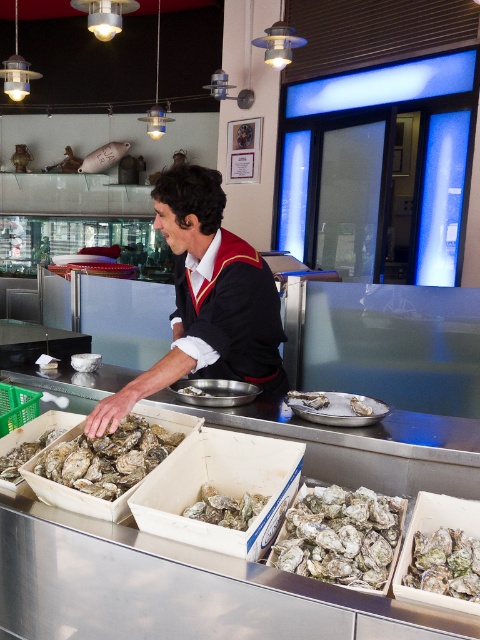
Question: Is shiny gray oyster at center further to camera compared to shiny silver oyster at lower left?

Choices:
 (A) no
 (B) yes

Answer: (A)

Question: Does white matte oyster at center appear under shiny silver oyster at lower left?

Choices:
 (A) yes
 (B) no

Answer: (A)

Question: Which point is closer to the camera?

Choices:
 (A) black fabric shirt at center
 (B) shiny silver oyster at center
 (C) white matte oyster at lower right
 (D) shiny gray oyster at center

Answer: (C)

Question: Estimate the real-world distances between objects in this image. Which object is closer to the shiny silver oyster at center?

Choices:
 (A) white matte oyster at center
 (B) white matte oyster at lower right
 (C) black fabric shirt at center

Answer: (A)

Question: Is shiny gray oyster at center further to camera compared to white matte oyster at center?

Choices:
 (A) yes
 (B) no

Answer: (B)

Question: Among these points, which one is farthest from the camera?

Choices:
 (A) (253, 502)
 (B) (107, 444)

Answer: (B)